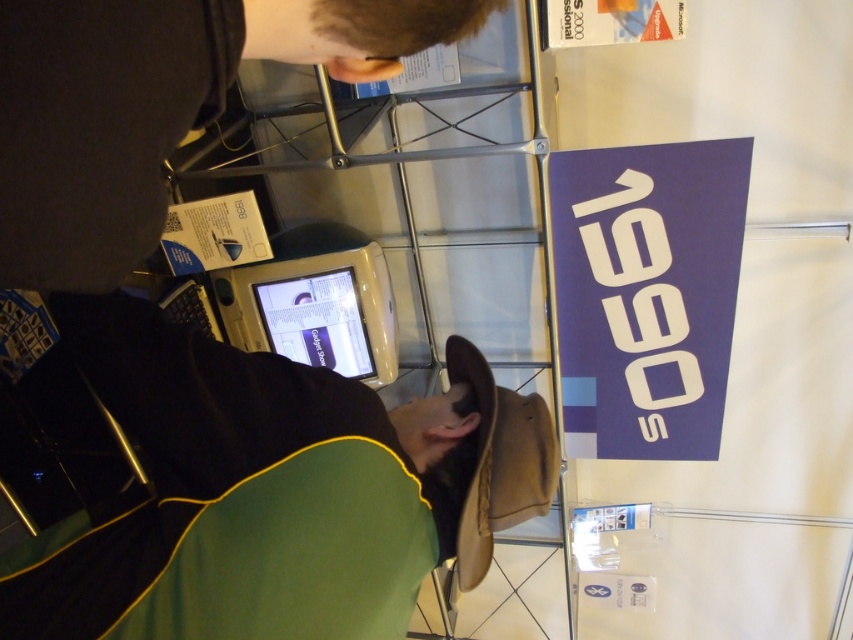
Question: Is matte blue sign at upper right to the right of matte plastic computer screen at center from the viewer's perspective?

Choices:
 (A) yes
 (B) no

Answer: (A)

Question: Which object appears farthest from the camera in this image?

Choices:
 (A) dark brown leather jacket at upper center
 (B) black matte hat at center
 (C) matte plastic computer screen at center
 (D) white plastic computer at center

Answer: (C)

Question: Does matte blue sign at upper right appear under matte plastic computer screen at center?

Choices:
 (A) yes
 (B) no

Answer: (B)

Question: Which of these objects is positioned farthest from the matte plastic computer screen at center?

Choices:
 (A) dark brown leather jacket at upper center
 (B) matte blue sign at upper right
 (C) black matte hat at center
 (D) white plastic computer at center

Answer: (A)

Question: Estimate the real-world distances between objects in this image. Which object is farther from the black matte hat at center?

Choices:
 (A) white plastic computer at center
 (B) matte blue sign at upper right
 (C) dark brown leather jacket at upper center
 (D) matte plastic computer screen at center

Answer: (D)

Question: Is dark brown leather jacket at upper center to the left of matte blue sign at upper right from the viewer's perspective?

Choices:
 (A) yes
 (B) no

Answer: (A)